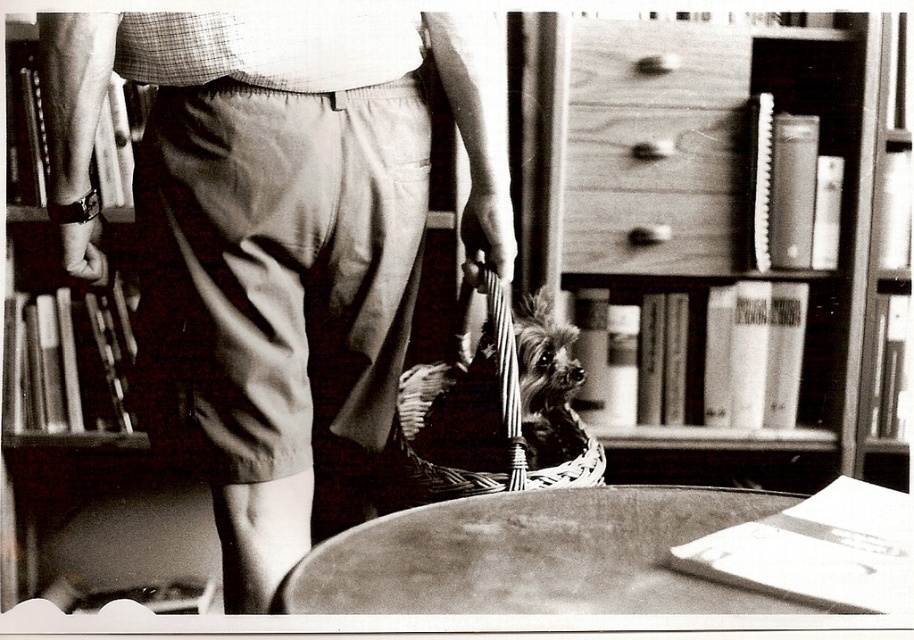
You are organizing a photo album and want to describe the position of the smooth wood bookshelf at left and the fuzzy brown dog at center in this black and white photo. Which object is placed higher in the image?

The smooth wood bookshelf at left is placed higher than the fuzzy brown dog at center in the image.

You are organizing a bookshelf and need to place a new book. You are standing in front of the smooth wood bookshelf at left and the woven straw basket at center. Which object is closer to you?

The smooth wood bookshelf at left is closer to you than the woven straw basket at center because it is further to the viewer.

You are a photographer trying to capture a closeup of the fuzzy brown dog at center without the woven straw basket at center being in the shot. Given that the two are 1.25 inches apart, can you focus on the dog while blurring the basket using a shallow depth of field?

The woven straw basket at center and fuzzy brown dog at center are 1.25 inches apart, so using a shallow depth of field might blur the basket slightly but may not completely remove it from the frame since they are relatively close. Adjust your focus precisely on the dog to minimize the basket visibility.